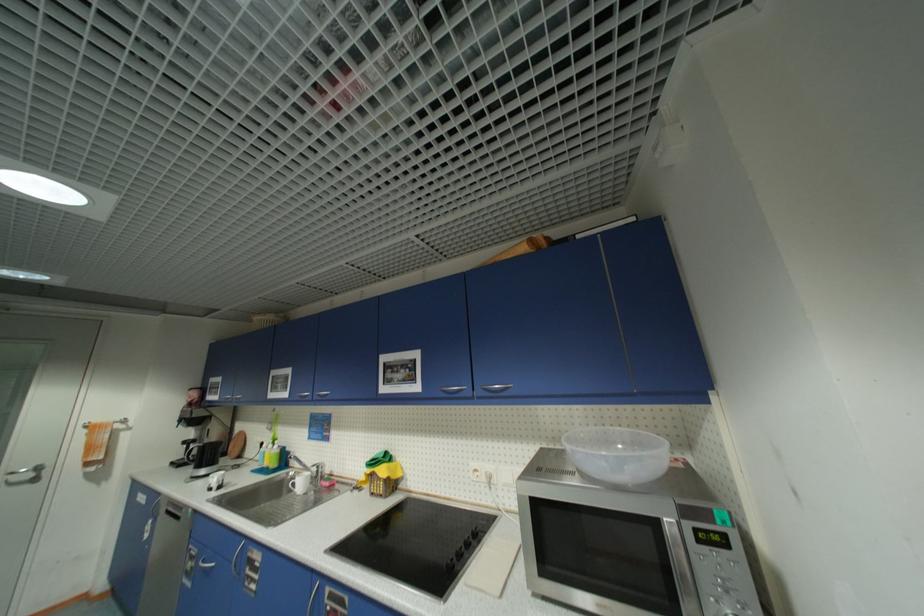
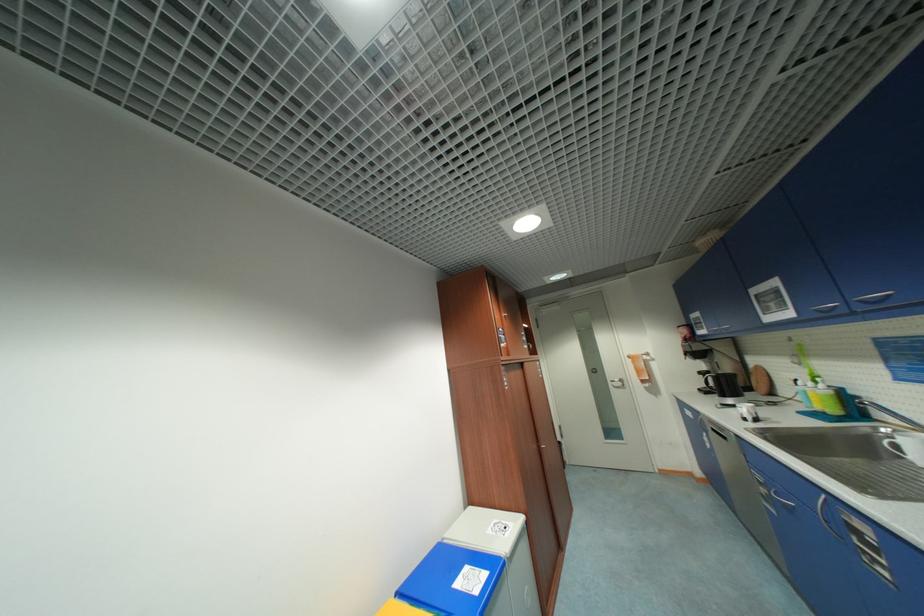
The point at (x=196, y=565) is marked in the first image. Where is the corresponding point in the second image?

(768, 491)